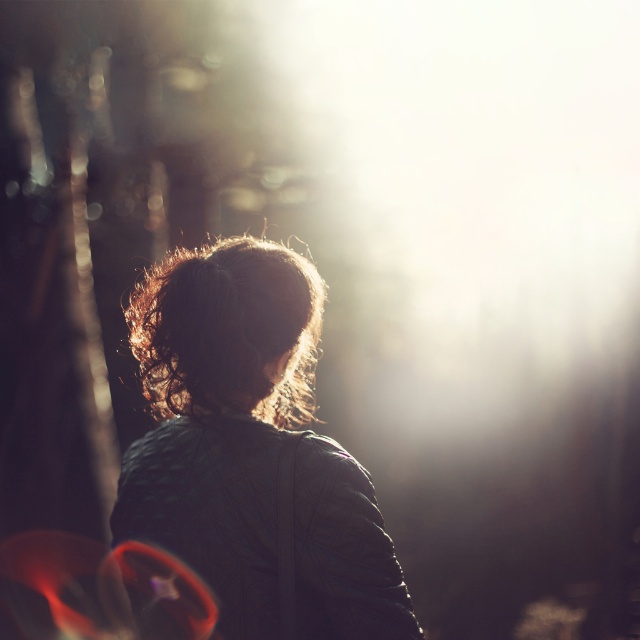
Question: Is matte black jacket at center above curly brown hair at center?

Choices:
 (A) no
 (B) yes

Answer: (A)

Question: Which point is farther from the camera taking this photo?

Choices:
 (A) (186, 268)
 (B) (212, 412)

Answer: (A)

Question: Is the position of matte black jacket at center less distant than that of curly brown hair at center?

Choices:
 (A) yes
 (B) no

Answer: (A)

Question: Can you confirm if matte black jacket at center is positioned to the left of curly brown hair at center?

Choices:
 (A) yes
 (B) no

Answer: (B)

Question: Which of the following is the farthest from the observer?

Choices:
 (A) curly brown hair at center
 (B) matte black jacket at center

Answer: (A)